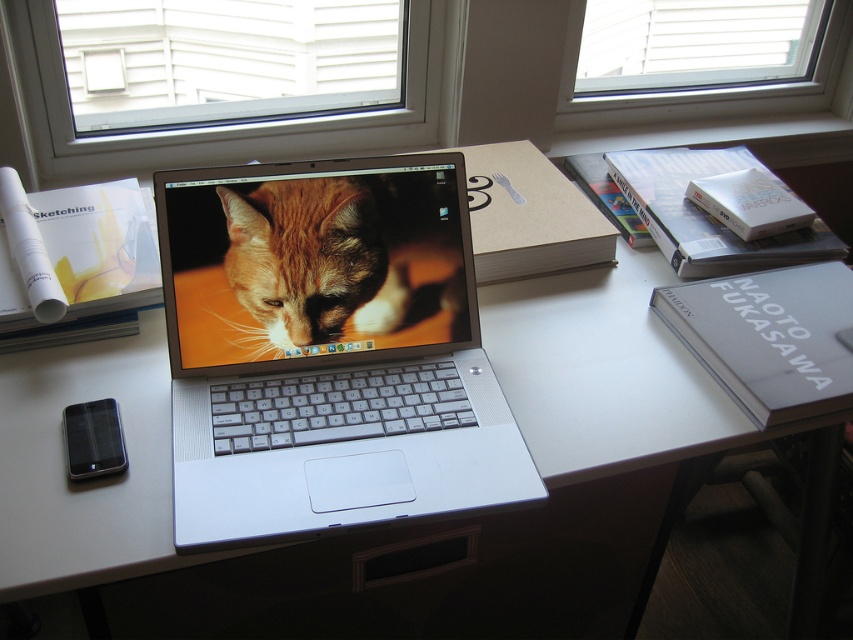
Which is more to the left, white plastic window at upper center or clear glass window at upper center?

white plastic window at upper center

In the scene shown: Can you confirm if white plastic window at upper center is bigger than clear glass window at upper center?

Actually, white plastic window at upper center might be smaller than clear glass window at upper center.

Where is `white plastic window at upper center`? The height and width of the screenshot is (640, 853). white plastic window at upper center is located at coordinates (225, 60).

Can you confirm if orange fur cat at center is taller than clear glass window at upper center?

No, orange fur cat at center is not taller than clear glass window at upper center.

Is point (440, 177) behind point (564, 90)?

No, it is not.

What are the coordinates of `orange fur cat at center` in the screenshot? It's located at (343, 253).

Between silver metallic laptop at center and white plastic window at upper center, which one appears on the left side from the viewer's perspective?

white plastic window at upper center

Between silver metallic laptop at center and white plastic window at upper center, which one has less height?

Standing shorter between the two is white plastic window at upper center.

Locate an element on the screen. silver metallic laptop at center is located at coordinates (328, 349).

Identify the location of silver metallic laptop at center. This screenshot has width=853, height=640. (328, 349).